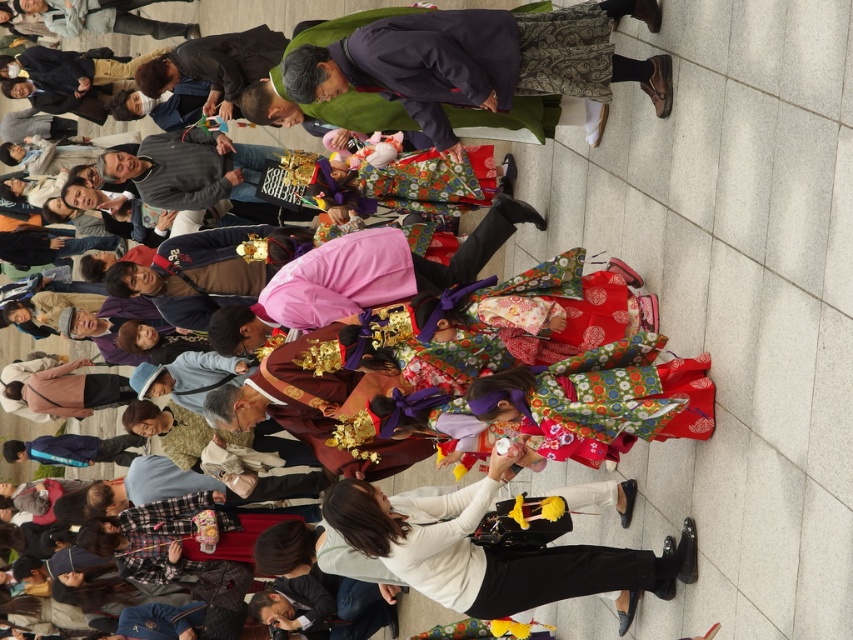
Between white matte pants at center and pink satin kimono at center, which one has less height?

With less height is pink satin kimono at center.

This screenshot has height=640, width=853. I want to click on white matte pants at center, so click(492, 548).